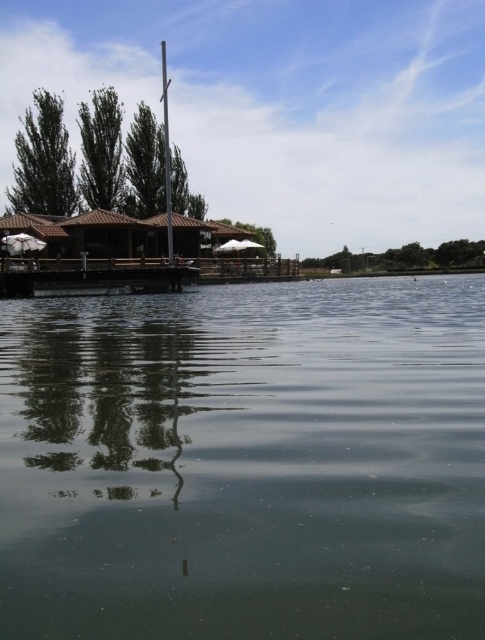
You are standing on the wooden pier and want to place a small floating platform in the water. The platform requires an area larger than the clear water at center. Can the smooth gray pole at center provide enough space for the platform?

The clear water at center has a smaller size compared to the smooth gray pole at center, so the smooth gray pole at center is larger and can provide enough space for the platform.

You are standing at the point marked as point (244,461) in the image. What do you see directly in front of you?

You see clear water at center directly in front of you at point (244,461).